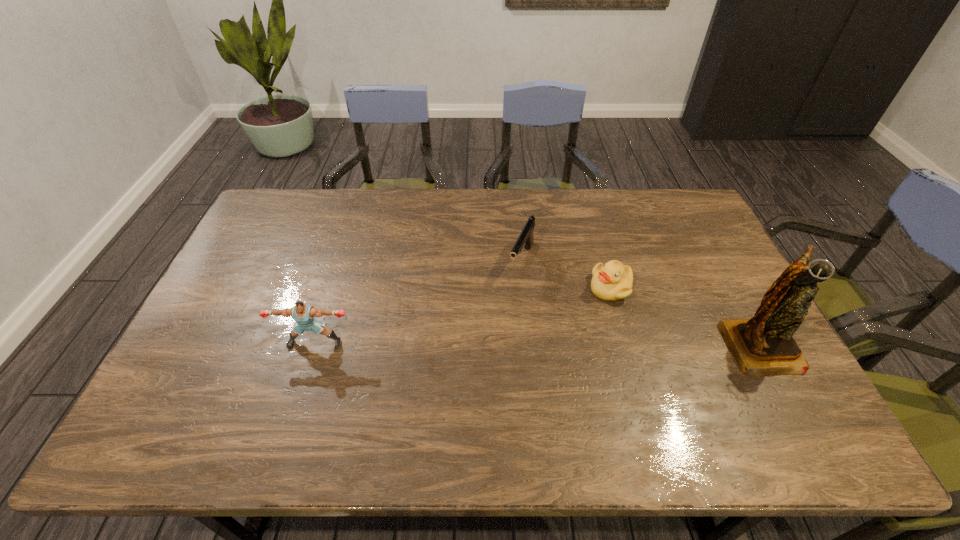
Find the location of `vacant space at the far left corner of the desktop`. vacant space at the far left corner of the desktop is located at coordinates [302, 212].

Find the location of a particular element. free space at the far right corner of the desktop is located at coordinates (656, 219).

You are a GUI agent. You are given a task and a screenshot of the screen. Output one action in this format:
    pyautogui.click(x=<x>, y=<y>)
    Task: Click on the empty location between the third object from right to left and the third object from left to right
    Image resolution: width=960 pixels, height=540 pixels.
    Given the screenshot: What is the action you would take?
    [x=566, y=274]

At what (x,y) coordinates should I click in order to perform the action: click on free space between the leftmost object and the third object from right to left. Please return your answer as a coordinate pair (x, y). Looking at the image, I should click on (419, 301).

Image resolution: width=960 pixels, height=540 pixels. In order to click on free spot between the tallest object and the third object from right to left in this screenshot , I will do `click(640, 302)`.

Locate an element on the screen. This screenshot has width=960, height=540. unoccupied area between the figurine and the duckling is located at coordinates (684, 316).

Where is `free space between the duckling and the leftmost object`? This screenshot has height=540, width=960. free space between the duckling and the leftmost object is located at coordinates (463, 315).

The width and height of the screenshot is (960, 540). I want to click on empty space that is in between the tallest object and the third object from left to right, so click(684, 316).

At what (x,y) coordinates should I click in order to perform the action: click on vacant space in between the puncher and the pistol. Please return your answer as a coordinate pair (x, y). The height and width of the screenshot is (540, 960). Looking at the image, I should click on pyautogui.click(x=419, y=301).

Locate an element on the screen. The image size is (960, 540). empty location between the second object from left to right and the second object from right to left is located at coordinates (566, 274).